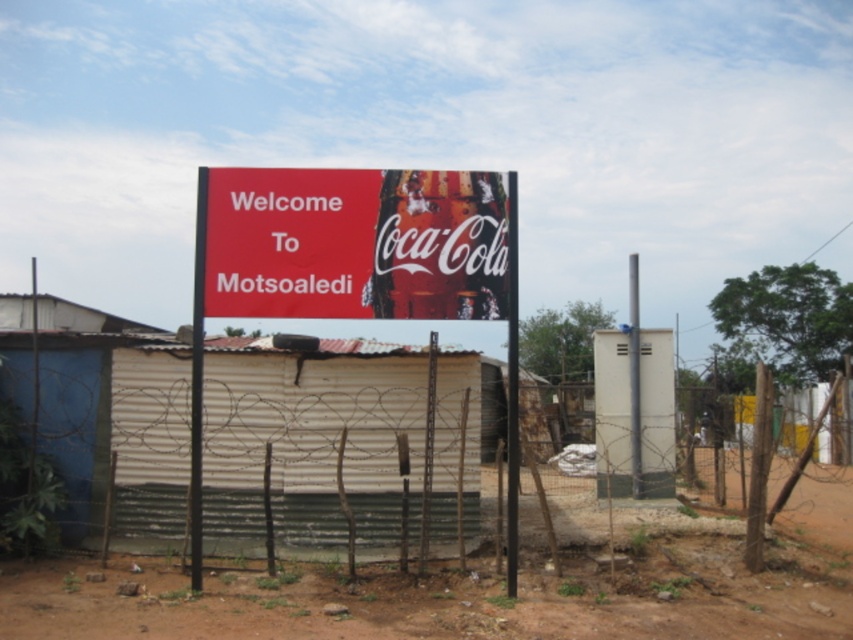
From the picture: Measure the distance between point (299, 614) and camera.

They are 7.45 meters apart.

Identify the location of brown dirt field at center. (445, 600).

Where is `brown dirt field at center`? The image size is (853, 640). brown dirt field at center is located at coordinates (445, 600).

Locate an element on the screen. brown dirt field at center is located at coordinates (445, 600).

Can you confirm if rusty wire fence at center is shorter than red matte signboard at center?

In fact, rusty wire fence at center may be taller than red matte signboard at center.

Who is positioned more to the left, rusty wire fence at center or red matte signboard at center?

rusty wire fence at center is more to the left.

Is point (223, 433) positioned after point (395, 227)?

Yes, it is behind point (395, 227).

Find the location of `rusty wire fence at center`. rusty wire fence at center is located at coordinates (309, 442).

Is rusty wire fence at center to the left of brown dirt field at center from the viewer's perspective?

Correct, you'll find rusty wire fence at center to the left of brown dirt field at center.

Does rusty wire fence at center have a lesser width compared to brown dirt field at center?

Indeed, rusty wire fence at center has a lesser width compared to brown dirt field at center.

Is point (166, 464) less distant than point (33, 570)?

That is False.

This screenshot has width=853, height=640. I want to click on rusty wire fence at center, so click(309, 442).